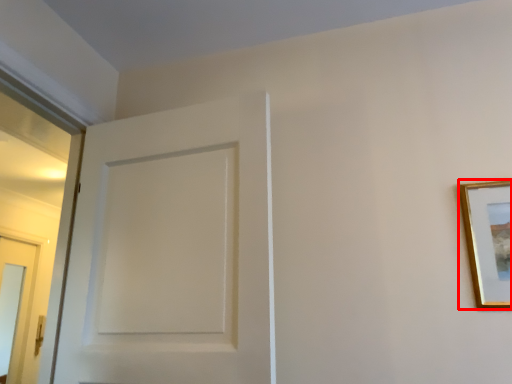
Question: From the image's perspective, what is the correct spatial relationship of picture frame (annotated by the red box) in relation to door?

Choices:
 (A) above
 (B) below

Answer: (B)